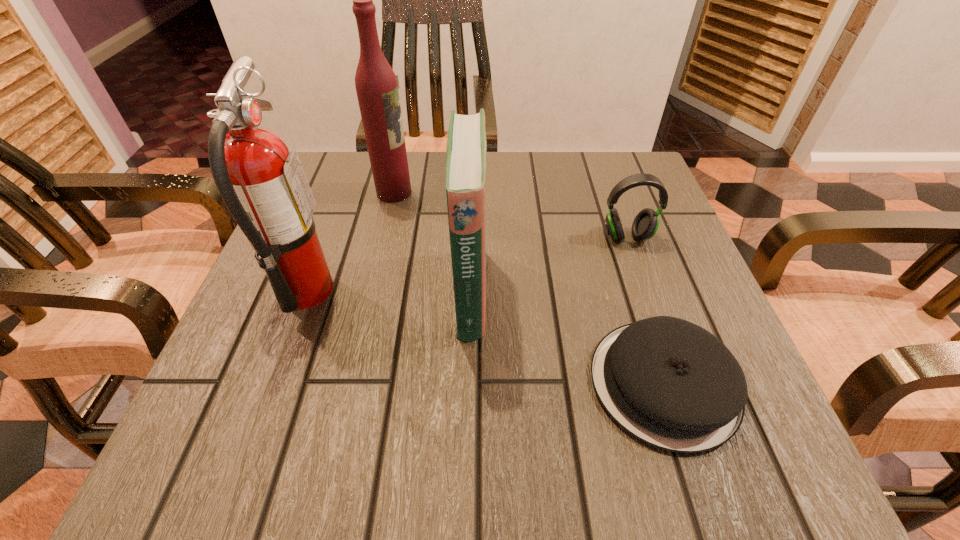
The width and height of the screenshot is (960, 540). Find the location of `liquor`. liquor is located at coordinates pyautogui.click(x=376, y=86).

This screenshot has height=540, width=960. I want to click on the farthest object, so click(x=376, y=86).

Identify the location of fire extinguisher. (263, 185).

Find the location of a particular element. The height and width of the screenshot is (540, 960). the third object from left to right is located at coordinates (466, 145).

The image size is (960, 540). I want to click on the third shortest object, so click(x=466, y=145).

This screenshot has height=540, width=960. I want to click on headset, so click(645, 225).

Identify the location of the fourth tallest object. (645, 225).

Where is `the shortest object`? The image size is (960, 540). the shortest object is located at coordinates (670, 383).

This screenshot has width=960, height=540. I want to click on vacant area situated on the label of the fourth object from right to left, so click(x=461, y=193).

Where is `vacant space located on the nozzle side of the leftmost object`? The image size is (960, 540). vacant space located on the nozzle side of the leftmost object is located at coordinates (452, 291).